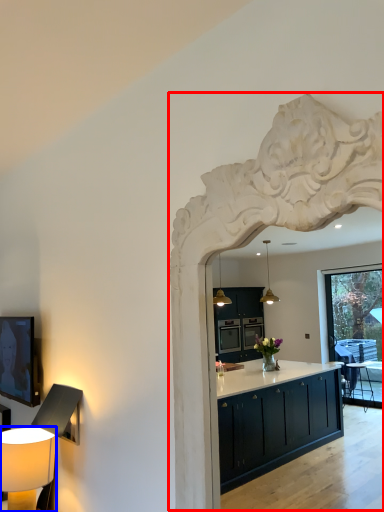
Question: Among these objects, which one is farthest to the camera, archway (highlighted by a red box) or table lamp (highlighted by a blue box)?

Choices:
 (A) archway
 (B) table lamp

Answer: (B)